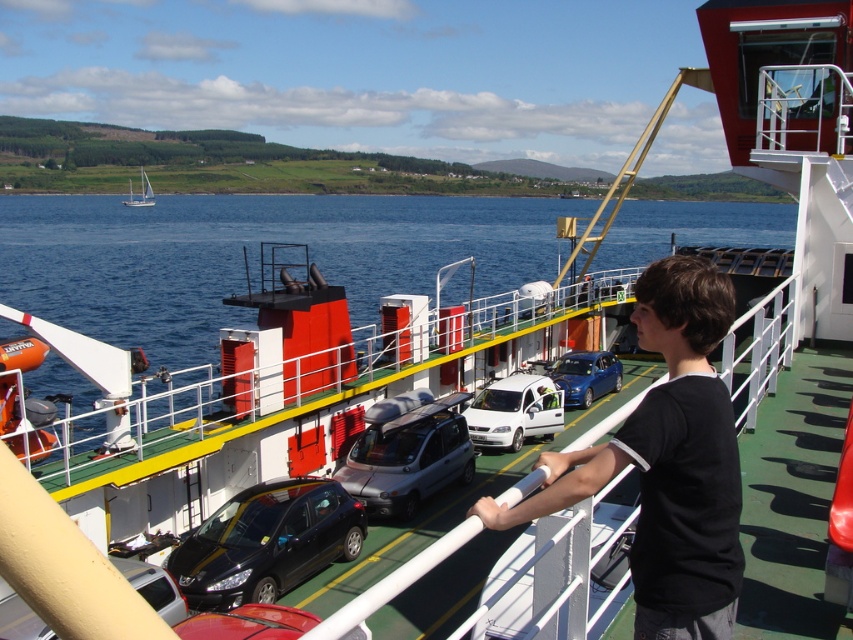
Question: Which point is closer to the camera taking this photo?

Choices:
 (A) (646, 532)
 (B) (183, 611)
 (C) (633, 216)

Answer: (A)

Question: Which point is farther to the camera?

Choices:
 (A) blue water at center
 (B) white matte van at center
 (C) silver metallic van at center
 (D) blue metallic car at center

Answer: (D)

Question: Does blue water at center have a lesser width compared to silver metallic van at center?

Choices:
 (A) yes
 (B) no

Answer: (B)

Question: Does silver metallic van at center lie in front of white sailboat at upper left?

Choices:
 (A) yes
 (B) no

Answer: (A)

Question: Is white matte van at center in front of metallic silver car at center?

Choices:
 (A) no
 (B) yes

Answer: (A)

Question: Among these points, which one is nearest to the camera?

Choices:
 (A) (482, 396)
 (B) (273, 225)

Answer: (A)